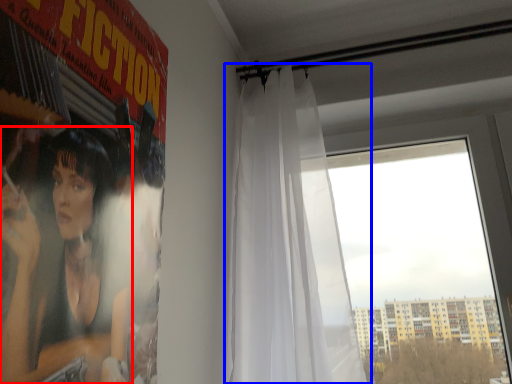
Question: Which point is further to the camera, person (highlighted by a red box) or curtain (highlighted by a blue box)?

Choices:
 (A) person
 (B) curtain

Answer: (B)